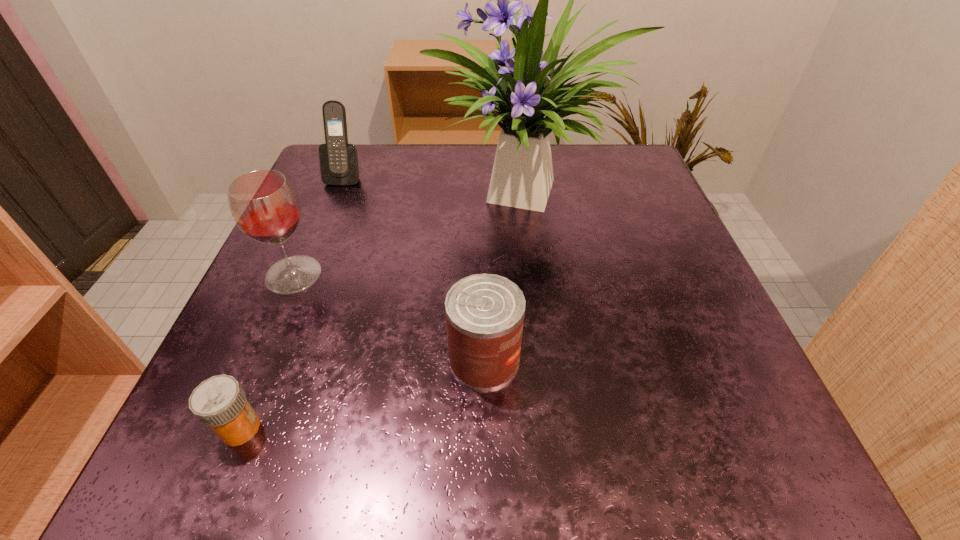
Where is `vacant point located between the fourth farthest object and the cellular telephone`? The image size is (960, 540). vacant point located between the fourth farthest object and the cellular telephone is located at coordinates click(x=415, y=268).

The image size is (960, 540). I want to click on vacant area that lies between the can and the third shortest object, so click(415, 268).

You are a GUI agent. You are given a task and a screenshot of the screen. Output one action in this format:
    pyautogui.click(x=<x>, y=<y>)
    Task: Click on the free point between the shortest object and the tallest object
    
    Given the screenshot: What is the action you would take?
    (385, 309)

Locate an element on the screen. The image size is (960, 540). free point between the nearest object and the third shortest object is located at coordinates (293, 302).

I want to click on free point between the cellular telephone and the can, so click(415, 268).

This screenshot has width=960, height=540. I want to click on vacant area that lies between the fourth tallest object and the wineglass, so click(389, 317).

This screenshot has height=540, width=960. I want to click on free space that is in between the medicine and the third tallest object, so click(293, 302).

Where is `object that ranks as the closest to the wineglass`? The image size is (960, 540). object that ranks as the closest to the wineglass is located at coordinates (525, 88).

I want to click on the closest object relative to the third tallest object, so click(x=525, y=88).

Identify the location of free location that satisfies the following two spatial constraints: 1. on the back side of the fourth tallest object; 2. on the left side of the tallest object. The width and height of the screenshot is (960, 540). (483, 191).